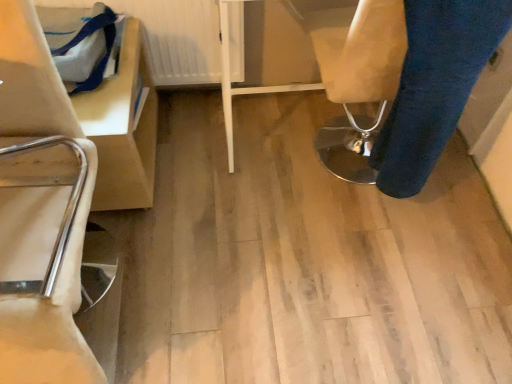
Question: Relative to white textured radiator at upper left, is blue denim trousers at lower right in front or behind?

Choices:
 (A) front
 (B) behind

Answer: (A)

Question: Based on their sizes in the image, would you say blue denim trousers at lower right is bigger or smaller than white textured radiator at upper left?

Choices:
 (A) small
 (B) big

Answer: (B)

Question: Considering the relative positions of blue denim trousers at lower right and white textured radiator at upper left in the image provided, is blue denim trousers at lower right to the left or to the right of white textured radiator at upper left?

Choices:
 (A) right
 (B) left

Answer: (A)

Question: From the image's perspective, is white textured radiator at upper left above or below blue denim trousers at lower right?

Choices:
 (A) below
 (B) above

Answer: (B)

Question: Is white textured radiator at upper left inside the boundaries of blue denim trousers at lower right, or outside?

Choices:
 (A) inside
 (B) outside

Answer: (B)

Question: Is white textured radiator at upper left wider or thinner than blue denim trousers at lower right?

Choices:
 (A) wide
 (B) thin

Answer: (B)

Question: From a real-world perspective, is white textured radiator at upper left above or below blue denim trousers at lower right?

Choices:
 (A) below
 (B) above

Answer: (A)